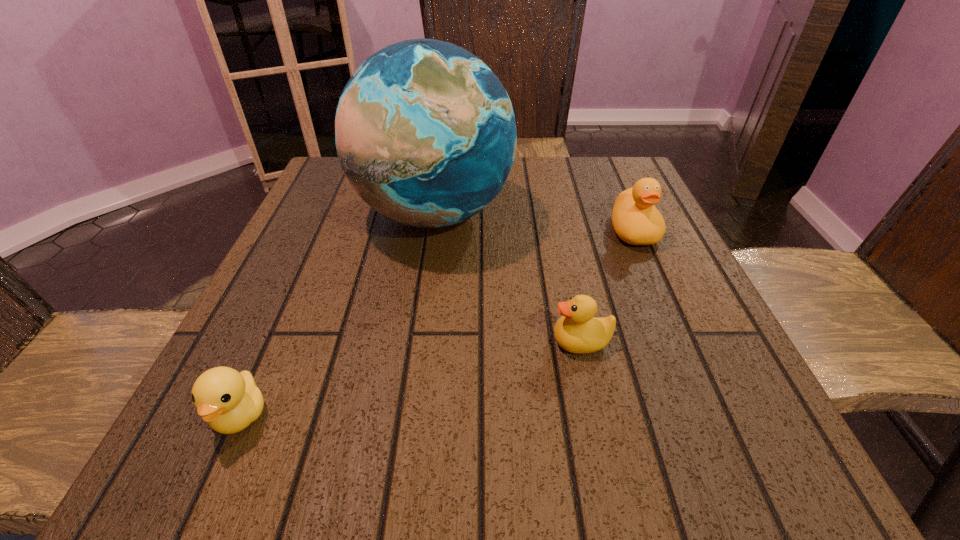
I want to click on vacant space that is in between the rightmost object and the third object from left to right, so click(608, 286).

I want to click on vacant region between the tallest object and the leftmost duck, so tap(337, 314).

Locate an element on the screen. Image resolution: width=960 pixels, height=540 pixels. empty space between the third shortest object and the globe is located at coordinates (534, 222).

This screenshot has width=960, height=540. Identify the location of vacant region between the third object from left to right and the second tallest object. (608, 286).

The width and height of the screenshot is (960, 540). I want to click on empty space between the rightmost object and the leftmost object, so click(x=437, y=323).

Find the location of a particular element. The height and width of the screenshot is (540, 960). free space between the third farthest object and the rightmost object is located at coordinates (608, 286).

Locate an element on the screen. The height and width of the screenshot is (540, 960). object that is the third closest one to the globe is located at coordinates (229, 401).

Point out which object is positioned as the second nearest to the tallest duck. Please provide its 2D coordinates. Your answer should be formatted as a tuple, i.e. [(x, y)], where the tuple contains the x and y coordinates of a point satisfying the conditions above.

[(577, 331)]

I want to click on duck identified as the closest to the leftmost duck, so click(577, 331).

Locate an element on the screen. duck that is the second nearest to the nearest duck is located at coordinates (636, 220).